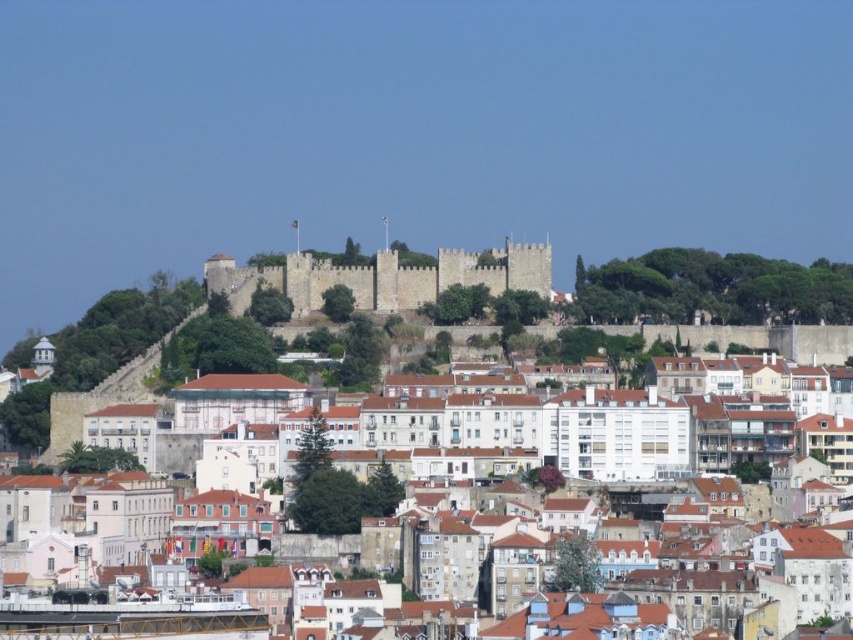
Question: Which point is closer to the camera taking this photo?

Choices:
 (A) (248, 268)
 (B) (467, 403)

Answer: (B)

Question: Is the position of white stone buildings at center more distant than that of gray stone castle at center?

Choices:
 (A) no
 (B) yes

Answer: (A)

Question: Can you confirm if white stone buildings at center is smaller than gray stone castle at center?

Choices:
 (A) no
 (B) yes

Answer: (A)

Question: Among these points, which one is farthest from the camera?

Choices:
 (A) (361, 289)
 (B) (496, 444)

Answer: (A)

Question: Can you confirm if white stone buildings at center is bigger than gray stone castle at center?

Choices:
 (A) no
 (B) yes

Answer: (B)